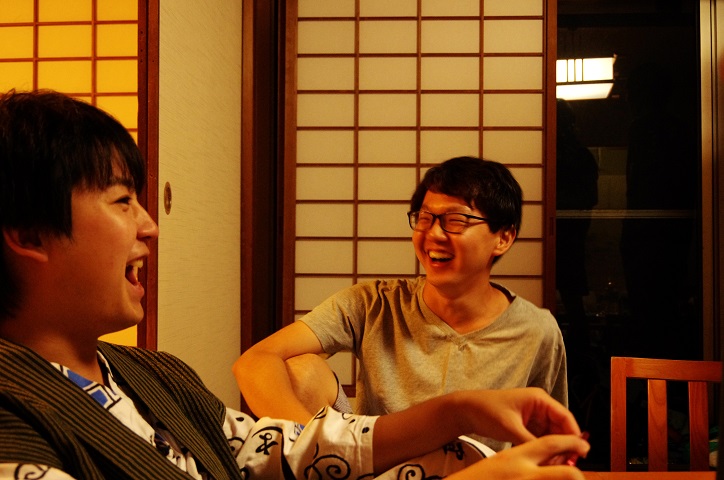
Find the location of a particular element. The image size is (724, 480). opening to next room is located at coordinates (625, 288).